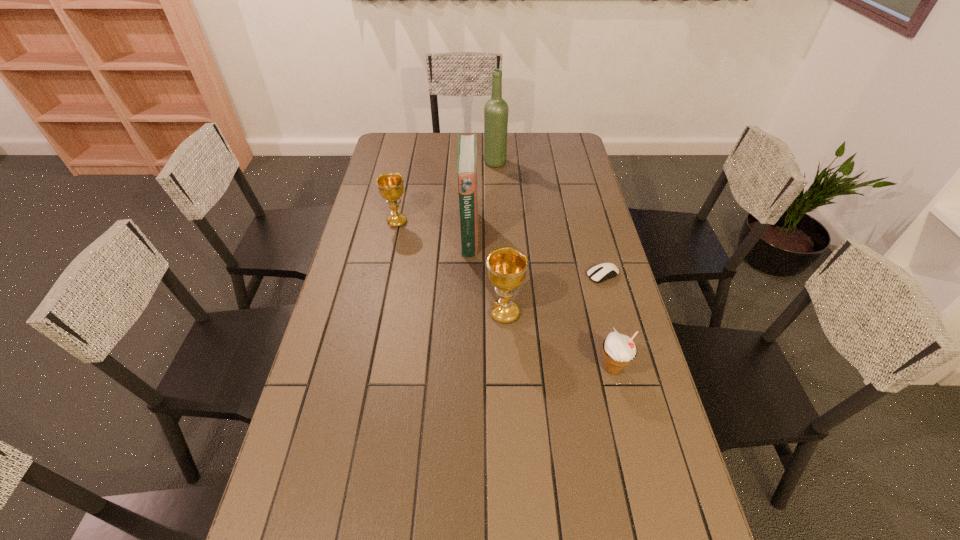
Where is `icecream`? This screenshot has height=540, width=960. icecream is located at coordinates (619, 350).

Locate an element on the screen. The width and height of the screenshot is (960, 540). free region located 0.290m on the right of the farther chalice is located at coordinates click(488, 222).

Locate an element on the screen. free space located on the back of the fourth shortest object is located at coordinates (502, 264).

Identify the location of vacant point located on the left of the wine bottle. The width and height of the screenshot is (960, 540). (393, 163).

Find the location of a particular element. vacant space located on the cover of the fifth object from right to left is located at coordinates (537, 234).

The height and width of the screenshot is (540, 960). I want to click on free point located 0.090m on the front of the shortest object, so [x=612, y=306].

The width and height of the screenshot is (960, 540). Find the location of `vacant space located on the front of the nearest object`. vacant space located on the front of the nearest object is located at coordinates (648, 519).

Find the location of a particular element. This screenshot has height=540, width=960. object that is at the far edge is located at coordinates (496, 109).

Find the location of a particular element. object positioned at the left edge is located at coordinates (391, 187).

Locate an element on the screen. mouse at the right edge is located at coordinates (599, 273).